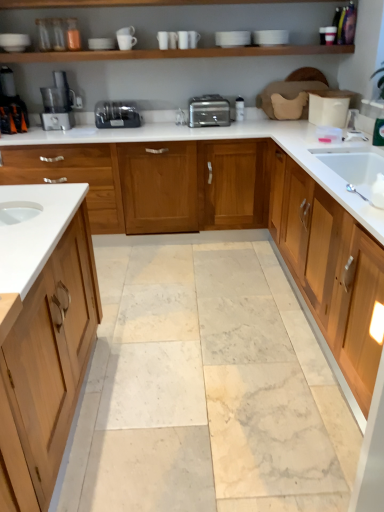
Question: In terms of size, does silver metallic faucet at center appear bigger or smaller than white glossy countertop at center?

Choices:
 (A) big
 (B) small

Answer: (B)

Question: From a real-world perspective, relative to white glossy countertop at center, is silver metallic faucet at center vertically above or below?

Choices:
 (A) below
 (B) above

Answer: (B)

Question: Estimate the real-world distances between objects in this image. Which object is closer to the white glossy countertop at center?

Choices:
 (A) silver metallic toaster at center
 (B) wooden cabinet at right
 (C) satin silver food processor at left
 (D) marble tile floor at center
 (E) black plastic coffee machine at left

Answer: (A)

Question: Based on their relative distances, which object is farther from the satin silver food processor at left?

Choices:
 (A) marble tile floor at center
 (B) satin silver toaster at center
 (C) white glossy countertop at center
 (D) silver metallic toaster at center
 (E) silver metallic faucet at center

Answer: (A)